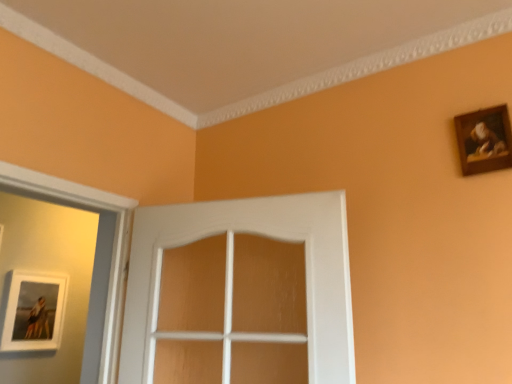
Question: Considering the positions of white wood door at center and wooden frame at upper right, which is counted as the first picture frame, starting from the front, in the image, is white wood door at center wider or thinner than wooden frame at upper right, which is counted as the first picture frame, starting from the front,?

Choices:
 (A) thin
 (B) wide

Answer: (B)

Question: Would you say white wood door at center is inside or outside wooden frame at upper right, the 2th picture frame when ordered from bottom to top?

Choices:
 (A) inside
 (B) outside

Answer: (B)

Question: Estimate the real-world distances between objects in this image. Which object is farther from the white wood door at center?

Choices:
 (A) wooden frame at upper right, placed as the first picture frame when sorted from right to left
 (B) matte white picture frame at lower left, positioned as the second picture frame in top-to-bottom order

Answer: (B)

Question: Which object is positioned farthest from the wooden frame at upper right, which is the 2th picture frame from back to front?

Choices:
 (A) matte white picture frame at lower left, the 2th picture frame viewed from the front
 (B) white wood door at center

Answer: (A)